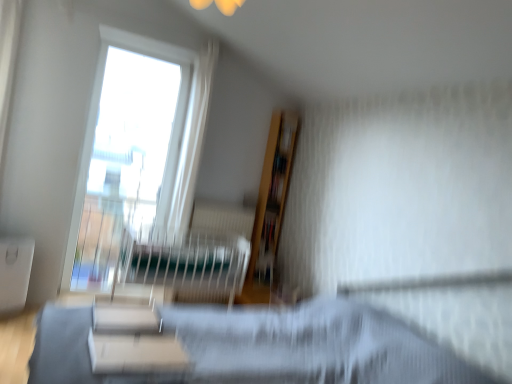
Question: Is there a large distance between wooden bookshelf at upper center and white matte table at lower center, placed as the first table when sorted from right to left?

Choices:
 (A) no
 (B) yes

Answer: (B)

Question: Is wooden bookshelf at upper center placed right next to white matte table at lower center, which is the 2th table in back-to-front order?

Choices:
 (A) no
 (B) yes

Answer: (A)

Question: From a real-world perspective, is wooden bookshelf at upper center physically below white matte table at lower center, which is the 2th table in back-to-front order?

Choices:
 (A) no
 (B) yes

Answer: (A)

Question: Can you confirm if wooden bookshelf at upper center is wider than white matte table at lower center, placed as the first table when sorted from right to left?

Choices:
 (A) yes
 (B) no

Answer: (B)

Question: Is wooden bookshelf at upper center bigger than white matte table at lower center, which ranks as the first table in front-to-back order?

Choices:
 (A) yes
 (B) no

Answer: (B)

Question: Considering the positions of wooden bookshelf at upper center and white matte table at lower center, placed as the first table when sorted from right to left, in the image, is wooden bookshelf at upper center taller or shorter than white matte table at lower center, placed as the first table when sorted from right to left,?

Choices:
 (A) tall
 (B) short

Answer: (A)

Question: Visually, is wooden bookshelf at upper center positioned to the left or to the right of white matte table at lower center, which is the 2th table in back-to-front order?

Choices:
 (A) right
 (B) left

Answer: (A)

Question: In terms of size, does wooden bookshelf at upper center appear bigger or smaller than white matte table at lower center, which ranks as the first table in front-to-back order?

Choices:
 (A) big
 (B) small

Answer: (B)

Question: Is wooden bookshelf at upper center inside the boundaries of white matte table at lower center, which ranks as the first table in front-to-back order, or outside?

Choices:
 (A) outside
 (B) inside

Answer: (A)

Question: From the image's perspective, is white glossy bookshelf at center located above or below wooden bookshelf at upper center?

Choices:
 (A) above
 (B) below

Answer: (B)

Question: Is point (96, 297) closer or farther from the camera than point (264, 251)?

Choices:
 (A) farther
 (B) closer

Answer: (B)

Question: Considering the positions of white glossy bookshelf at center and wooden bookshelf at upper center in the image, is white glossy bookshelf at center bigger or smaller than wooden bookshelf at upper center?

Choices:
 (A) small
 (B) big

Answer: (B)

Question: Is white glossy bookshelf at center in front of or behind wooden bookshelf at upper center in the image?

Choices:
 (A) behind
 (B) front

Answer: (B)

Question: Looking at their shapes, would you say matte black hospital bed at center is wider or thinner than white glossy bookshelf at center?

Choices:
 (A) thin
 (B) wide

Answer: (B)

Question: Considering the relative positions of matte black hospital bed at center and white glossy bookshelf at center in the image provided, is matte black hospital bed at center to the left or to the right of white glossy bookshelf at center?

Choices:
 (A) right
 (B) left

Answer: (A)